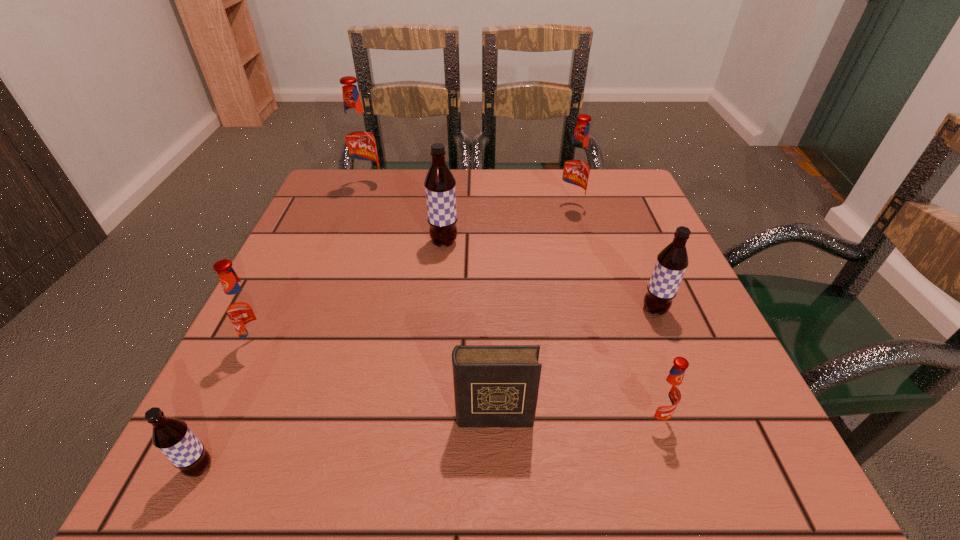
At what (x,y) coordinates should I click in order to perform the action: click on vacant space at the left edge of the desktop. Please return your answer as a coordinate pair (x, y). The width and height of the screenshot is (960, 540). Looking at the image, I should click on (341, 261).

You are a GUI agent. You are given a task and a screenshot of the screen. Output one action in this format:
    pyautogui.click(x=<x>, y=<y>)
    Task: Click on the vacant space at the right edge of the desktop
    This screenshot has height=540, width=960.
    Given the screenshot: What is the action you would take?
    coord(602,259)

In the image, there is a desktop. Where is `vacant space at the far right corner`? The image size is (960, 540). vacant space at the far right corner is located at coordinates (611, 201).

This screenshot has height=540, width=960. What are the coordinates of `empty space that is in between the diary and the leftmost red root beer` in the screenshot? It's located at (378, 381).

At what (x,y) coordinates should I click in order to perform the action: click on free spot between the diary and the leftmost brown root beer. Please return your answer as a coordinate pair (x, y). Looking at the image, I should click on (347, 443).

At what (x,y) coordinates should I click in order to perform the action: click on blank region between the second nearest root beer and the third farthest object. Please return your answer as a coordinate pair (x, y). This screenshot has height=540, width=960. Looking at the image, I should click on (549, 331).

Image resolution: width=960 pixels, height=540 pixels. Identify the location of free spot between the sixth nearest root beer and the second farthest brown root beer. (612, 259).

Where is `free space between the fifth object from left to right and the third smallest red root beer`? This screenshot has height=540, width=960. free space between the fifth object from left to right and the third smallest red root beer is located at coordinates (532, 313).

Identify the location of empty space between the sixth farthest root beer and the fourth object from right to left. The image size is (960, 540). (574, 418).

Find the location of a particular element. This screenshot has height=540, width=960. vacant space that's between the biggest red root beer and the seventh nearest object is located at coordinates (469, 197).